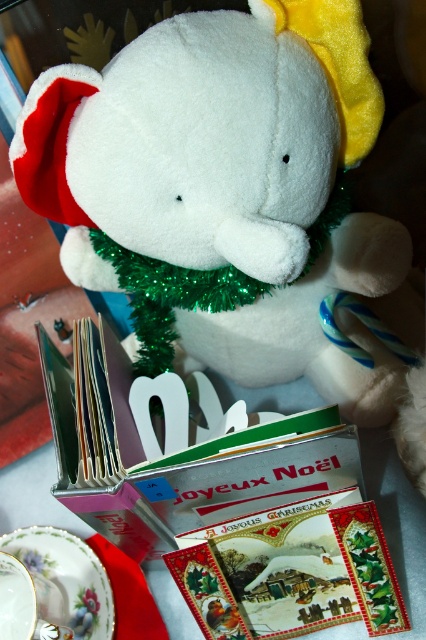
You are a child who wants to place a small toy mouse between the white plush toy at center and the porcelain floral saucer at lower left. Based on their positions, where should you place the mouse to ensure it is between them?

The white plush toy at center is positioned on the right side of the porcelain floral saucer at lower left, so you should place the mouse to the right of the porcelain floral saucer at lower left and to the left of the white plush toy at center to ensure it is between them.

What are the exact coordinates of the white plush toy at center?

The white plush toy at center is located at point (229, 188).